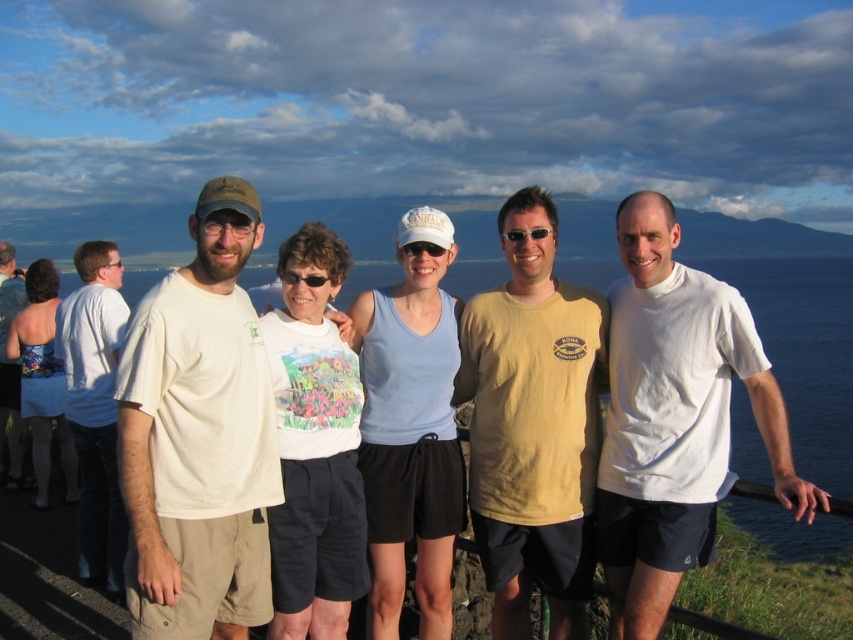
Who is positioned more to the left, white matte t-shirt at center or white t-shirt at left?

white t-shirt at left is more to the left.

Which is more to the right, white matte t-shirt at center or white t-shirt at left?

Positioned to the right is white matte t-shirt at center.

Which is behind, point (608, 595) or point (6, 408)?

The point (6, 408) is more distant.

Find the location of a particular element. white matte t-shirt at center is located at coordinates (674, 419).

Between point (485, 342) and point (421, 252), which one is positioned behind?

The point (485, 342) is behind.

Measure the distance between matte yellow t-shirt at center and camera.

matte yellow t-shirt at center is 20.89 feet from camera.

Locate an element on the screen. matte yellow t-shirt at center is located at coordinates (532, 426).

Can you confirm if white cotton t-shirt at center is positioned to the right of white matte t-shirt at center?

Incorrect, white cotton t-shirt at center is not on the right side of white matte t-shirt at center.

Does white cotton t-shirt at center have a lesser height compared to white matte t-shirt at center?

No, white cotton t-shirt at center is not shorter than white matte t-shirt at center.

Between point (207, 323) and point (611, 580), which one is positioned behind?

Point (611, 580)

Find the location of a particular element. Image resolution: width=853 pixels, height=640 pixels. white cotton t-shirt at center is located at coordinates (199, 435).